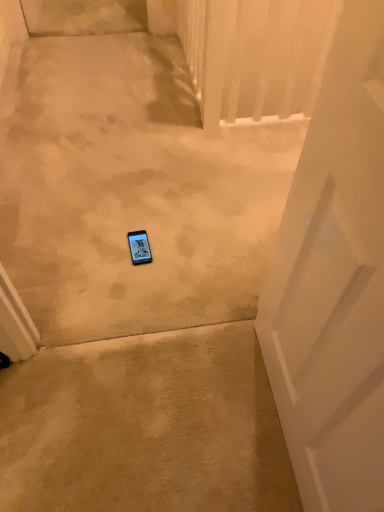
Where is `free location to the right of matte black phone at center`? free location to the right of matte black phone at center is located at coordinates (178, 251).